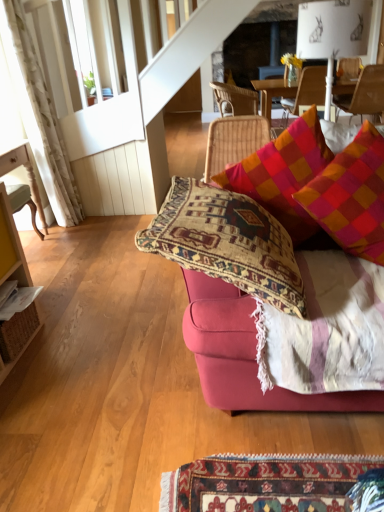
Question: Choose the correct answer: Is velvet pink couch at center inside plaid fabric pillow at upper right, positioned as the 1th pillow in right-to-left order, or outside it?

Choices:
 (A) inside
 (B) outside

Answer: (B)

Question: Would you say velvet pink couch at center is to the left or to the right of plaid fabric pillow at upper right, positioned as the 1th pillow in right-to-left order, in the picture?

Choices:
 (A) left
 (B) right

Answer: (A)

Question: Considering the real-world distances, which object is closest to the multicolored woven cushion at upper right, which is the first pillow from left to right?

Choices:
 (A) rattan chair at upper center, positioned as the 1th chair in back-to-front order
 (B) wooden chair at left, the first chair in the front-to-back sequence
 (C) plaid fabric pillow at upper right, the 2th pillow positioned from the left
 (D) white textured curtain at left
 (E) wooden chair at upper right, which is the fourth chair in left-to-right order

Answer: (C)

Question: Based on their relative distances, which object is nearer to the wooden chair at left, which appears as the 1th chair when viewed from the left?

Choices:
 (A) velvet pink couch at center
 (B) wooden chair at upper right, which is counted as the third chair, starting from the front
 (C) rattan chair at upper center, positioned as the 1th chair in back-to-front order
 (D) multicolored woven cushion at upper right, acting as the 2th pillow starting from the right
 (E) plaid fabric pillow at upper right, positioned as the 1th pillow in right-to-left order

Answer: (D)